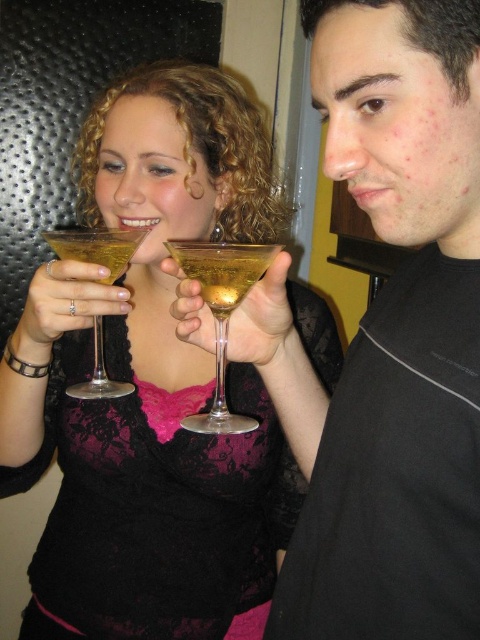
You are a photographer at a celebration and want to capture the clear glass martini glasses at center. You are standing at point (149, 385). Can you see the clear glass martini glasses at center from your current position?

Yes, because you are standing exactly at the point where the clear glass martini glasses at center are located, so they should be directly in front of you.

Looking at this image, you are a photographer adjusting lighting for a portrait. You notice the matte black shirt at right and the translucent glass martini at center. Which object will cast a darker shadow?

The matte black shirt at right will cast a darker shadow because its width is larger than the translucent glass martini at center, making its shadow more prominent.

You are a photographer adjusting the lighting for a portrait. You notice the clear glass martini glasses at center and the matte black shirt at right in the frame. Which object should you focus on first to ensure proper exposure, considering their positions?

The clear glass martini glasses at center should be focused on first because they are positioned over the matte black shirt at right, making them closer to the camera and thus requiring priority in exposure adjustment.